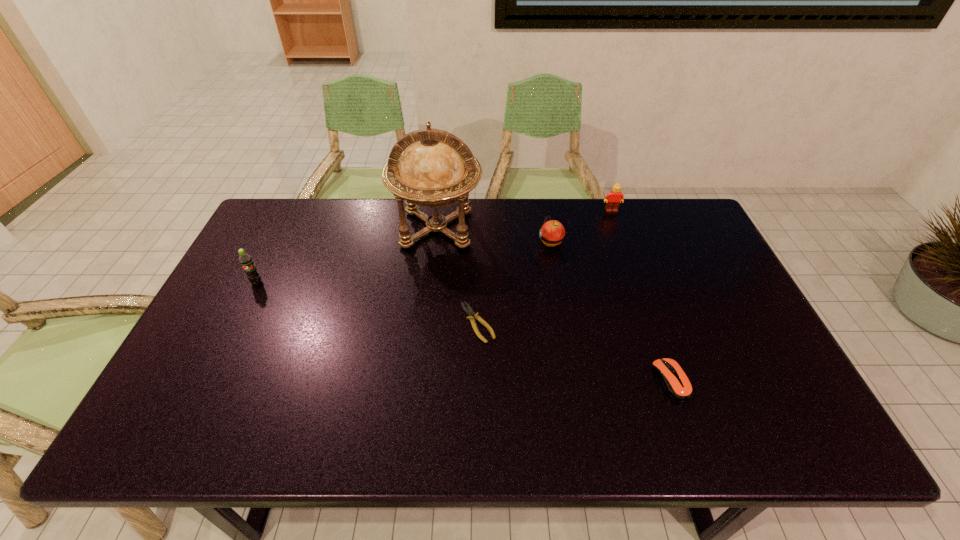
Find the location of a particular element. The width and height of the screenshot is (960, 540). the tallest object is located at coordinates (437, 169).

Where is `the leftmost object`? This screenshot has height=540, width=960. the leftmost object is located at coordinates (245, 260).

At what (x,y) coordinates should I click in order to perform the action: click on soda. Please return your answer as a coordinate pair (x, y). This screenshot has height=540, width=960. Looking at the image, I should click on (245, 260).

The height and width of the screenshot is (540, 960). I want to click on Lego, so click(613, 199).

Image resolution: width=960 pixels, height=540 pixels. I want to click on the fourth object from left to right, so click(x=552, y=233).

The width and height of the screenshot is (960, 540). What are the coordinates of `the fourth tallest object` in the screenshot? It's located at (552, 233).

Find the location of a particular element. The width and height of the screenshot is (960, 540). the second shortest object is located at coordinates (676, 384).

The image size is (960, 540). Find the location of `the nearest object`. the nearest object is located at coordinates (676, 384).

Identify the location of pliers. Image resolution: width=960 pixels, height=540 pixels. (469, 311).

The width and height of the screenshot is (960, 540). What are the coordinates of `the second nearest object` in the screenshot? It's located at (469, 311).